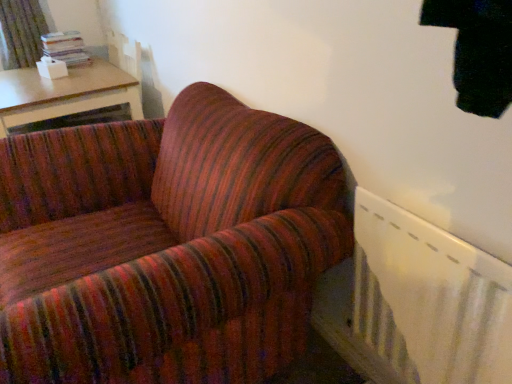
Question: Is the depth of wooden table at upper left less than that of white plastic radiator at lower right?

Choices:
 (A) no
 (B) yes

Answer: (A)

Question: Is wooden table at upper left positioned behind white plastic radiator at lower right?

Choices:
 (A) no
 (B) yes

Answer: (B)

Question: Is wooden table at upper left thinner than white plastic radiator at lower right?

Choices:
 (A) yes
 (B) no

Answer: (B)

Question: Considering the relative sizes of wooden table at upper left and white plastic radiator at lower right in the image provided, is wooden table at upper left taller than white plastic radiator at lower right?

Choices:
 (A) no
 (B) yes

Answer: (A)

Question: Does wooden table at upper left have a smaller size compared to white plastic radiator at lower right?

Choices:
 (A) yes
 (B) no

Answer: (B)

Question: Considering the positions of wooden table at upper left and white plastic radiator at lower right in the image, is wooden table at upper left bigger or smaller than white plastic radiator at lower right?

Choices:
 (A) small
 (B) big

Answer: (B)

Question: Relative to white plastic radiator at lower right, is wooden table at upper left in front or behind?

Choices:
 (A) front
 (B) behind

Answer: (B)

Question: From the image's perspective, is wooden table at upper left positioned above or below white plastic radiator at lower right?

Choices:
 (A) above
 (B) below

Answer: (A)

Question: Considering the positions of wooden table at upper left and white plastic radiator at lower right in the image, is wooden table at upper left taller or shorter than white plastic radiator at lower right?

Choices:
 (A) tall
 (B) short

Answer: (B)

Question: Is green textured curtain at upper left situated inside white plastic radiator at lower right or outside?

Choices:
 (A) inside
 (B) outside

Answer: (B)

Question: Based on their positions, is green textured curtain at upper left located to the left or right of white plastic radiator at lower right?

Choices:
 (A) left
 (B) right

Answer: (A)

Question: From the image's perspective, is green textured curtain at upper left above or below white plastic radiator at lower right?

Choices:
 (A) below
 (B) above

Answer: (B)

Question: Looking at their shapes, would you say green textured curtain at upper left is wider or thinner than white plastic radiator at lower right?

Choices:
 (A) thin
 (B) wide

Answer: (B)

Question: Is green textured curtain at upper left bigger or smaller than wooden table at upper left?

Choices:
 (A) big
 (B) small

Answer: (B)

Question: Is point (27, 14) positioned closer to the camera than point (61, 82)?

Choices:
 (A) closer
 (B) farther

Answer: (B)